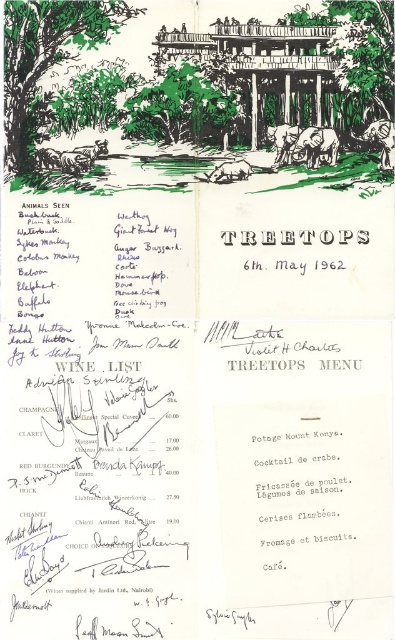
Question: Among these objects, which one is farthest from the camera?

Choices:
 (A) green leafy tree at center
 (B) green ink tree at upper left

Answer: (A)

Question: Does green ink tree at upper left have a greater width compared to green leafy tree at center?

Choices:
 (A) yes
 (B) no

Answer: (A)

Question: Does green ink tree at upper left have a lesser width compared to green leafy tree at center?

Choices:
 (A) yes
 (B) no

Answer: (B)

Question: In this image, where is green ink tree at upper left located relative to green leafy tree at center?

Choices:
 (A) right
 (B) left

Answer: (B)

Question: Which object is farther from the camera taking this photo?

Choices:
 (A) green ink tree at upper left
 (B) green leafy tree at center

Answer: (B)